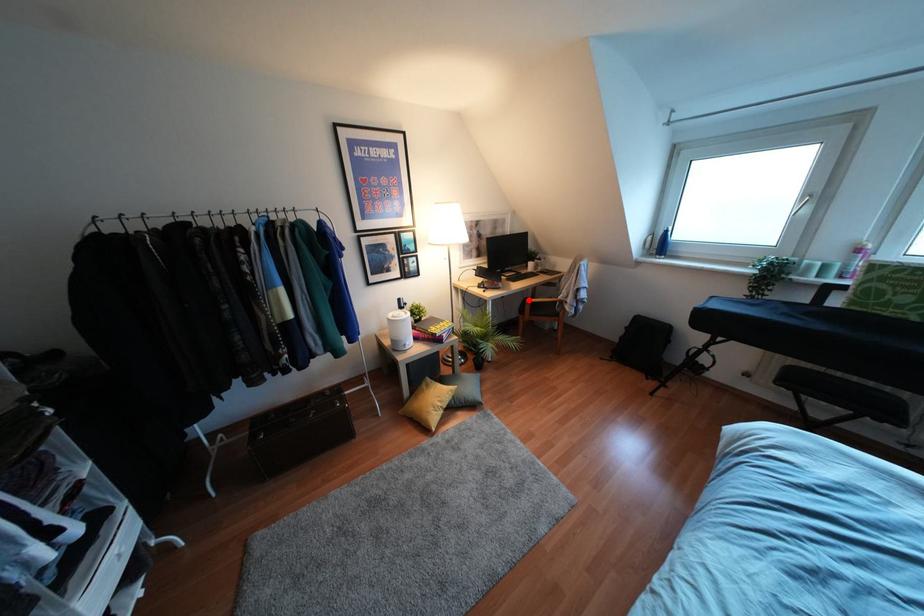
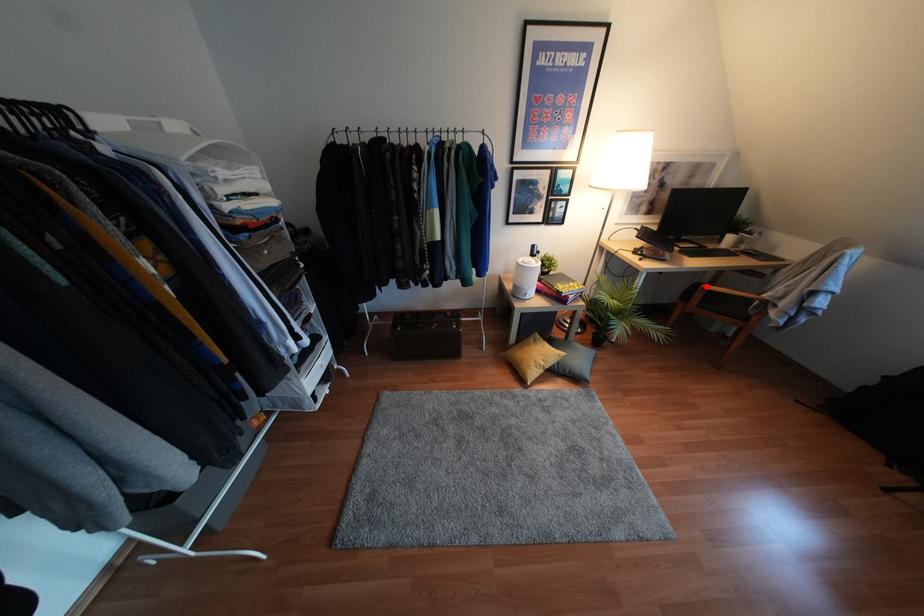
I am providing you with two images of the same scene from different viewpoints. A red point is marked on the first image and another point is marked on the second image. Do the highlighted points in image1 and image2 indicate the same real-world spot?

Yes